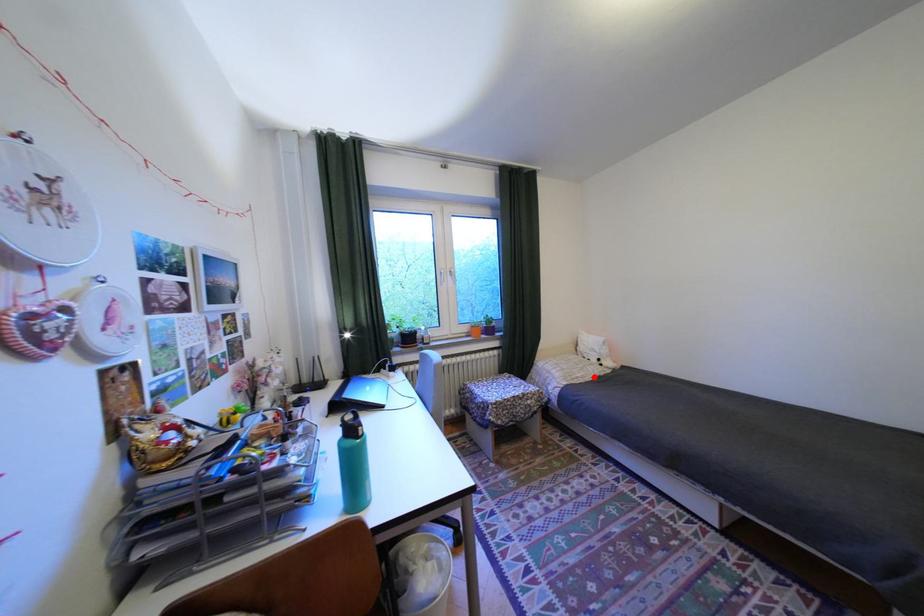
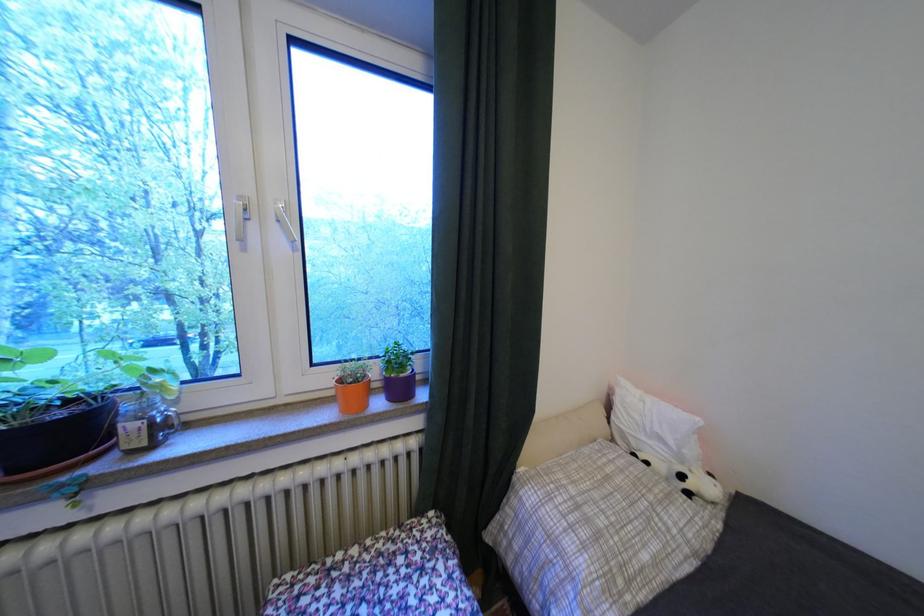
Find the pixel in the second image that matches the highlighted location in the first image.

(667, 562)